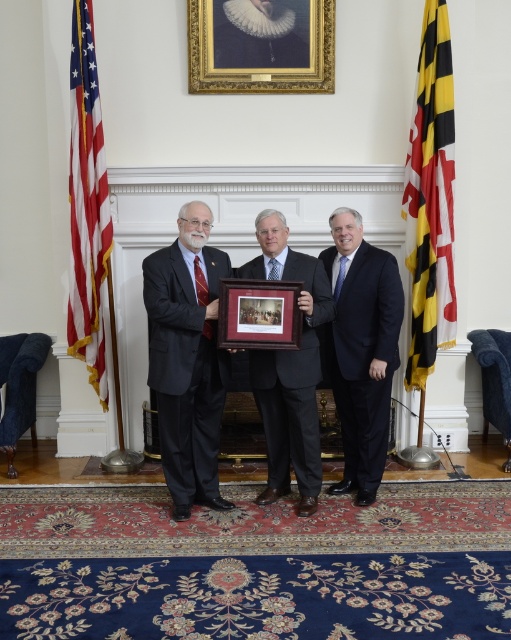
Is matte black suit at center below dark blue suit at center?

Yes.

Is matte black suit at center to the right of dark blue suit at center from the viewer's perspective?

No, matte black suit at center is not to the right of dark blue suit at center.

The height and width of the screenshot is (640, 511). Describe the element at coordinates (188, 358) in the screenshot. I see `matte black suit at center` at that location.

Where is `matte black suit at center`? This screenshot has height=640, width=511. matte black suit at center is located at coordinates (188, 358).

Is yellow/black striped flag at right closer to camera compared to wooden polished picture frame at center?

No, it is not.

Is yellow/black striped flag at right bigger than wooden polished picture frame at center?

Yes, yellow/black striped flag at right is bigger than wooden polished picture frame at center.

The width and height of the screenshot is (511, 640). Describe the element at coordinates (430, 198) in the screenshot. I see `yellow/black striped flag at right` at that location.

Find the location of a particular element. The image size is (511, 640). yellow/black striped flag at right is located at coordinates (430, 198).

Does dark blue suit at center have a greater height compared to yellow/black striped flag at right?

No.

Between dark blue suit at center and yellow/black striped flag at right, which one appears on the right side from the viewer's perspective?

yellow/black striped flag at right is more to the right.

What do you see at coordinates (361, 349) in the screenshot?
I see `dark blue suit at center` at bounding box center [361, 349].

The width and height of the screenshot is (511, 640). In order to click on dark blue suit at center in this screenshot , I will do `click(361, 349)`.